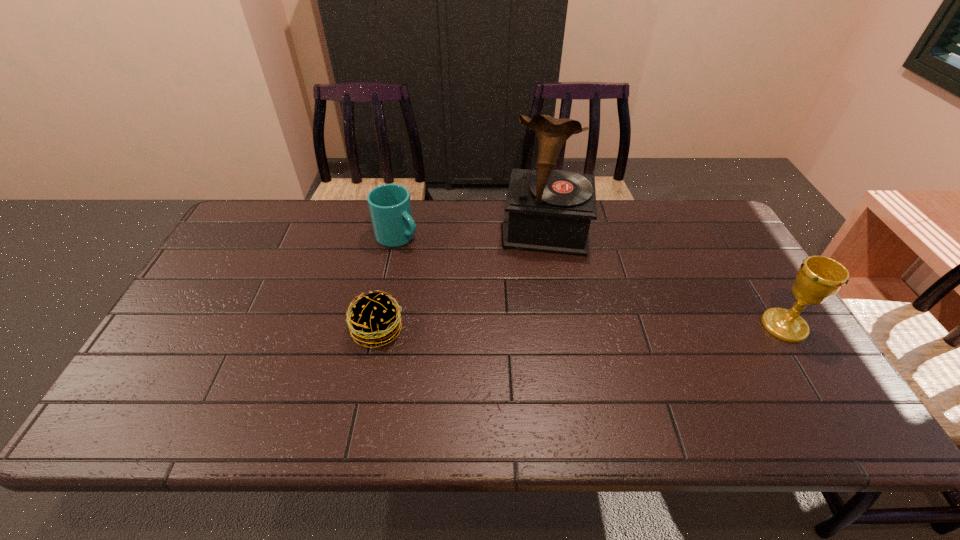
Find the location of a particular element. The image size is (960, 540). vacant space situated 0.280m at the horn opening of the third object from left to right is located at coordinates (539, 330).

Image resolution: width=960 pixels, height=540 pixels. I want to click on vacant area located 0.270m on the handle side of the third tallest object, so click(x=480, y=287).

This screenshot has width=960, height=540. I want to click on vacant space situated on the handle side of the third tallest object, so click(471, 282).

Identify the location of free spot located on the handle side of the third tallest object. (488, 292).

This screenshot has height=540, width=960. What are the coordinates of `phonograph_record present at the far edge` in the screenshot? It's located at [550, 211].

The height and width of the screenshot is (540, 960). What are the coordinates of `cup present at the far edge` in the screenshot? It's located at (390, 208).

What are the coordinates of `object situated at the right edge` in the screenshot? It's located at (818, 278).

Locate an element on the screen. vacant region at the far edge of the desktop is located at coordinates (301, 242).

This screenshot has height=540, width=960. Find the location of `free region at the near edge of the desktop`. free region at the near edge of the desktop is located at coordinates (398, 389).

Find the location of a particular element. vacant space at the left edge of the desktop is located at coordinates click(x=237, y=262).